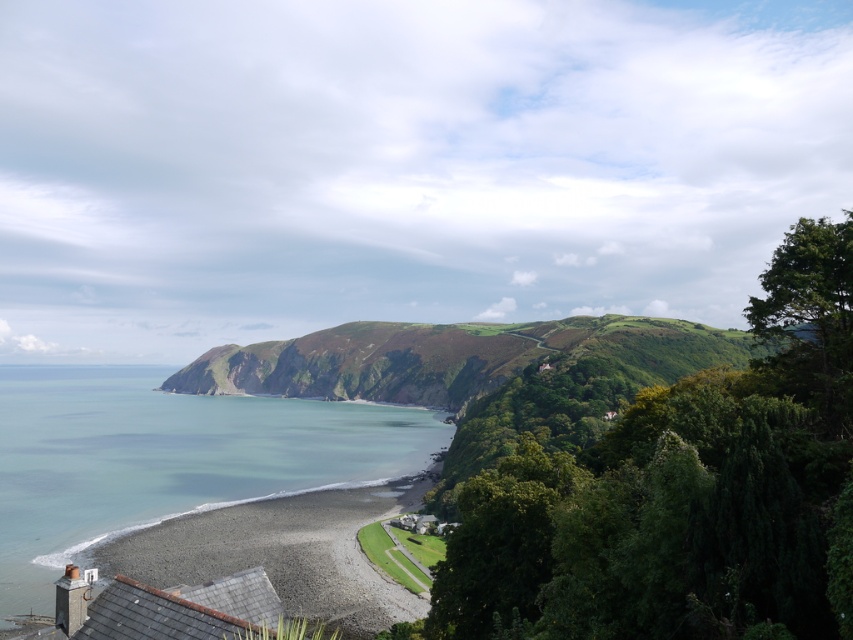
Is point (106, 381) behind point (125, 544)?

Yes, it is behind point (125, 544).

Does blue water at lower left have a greater height compared to gray gravel beach at lower left?

No, blue water at lower left is not taller than gray gravel beach at lower left.

Who is more distant from viewer, (x=396, y=467) or (x=184, y=532)?

Point (x=396, y=467)

You are a GUI agent. You are given a task and a screenshot of the screen. Output one action in this format:
    pyautogui.click(x=<x>, y=<y>)
    Task: Click on the blue water at lower left
    This screenshot has height=640, width=853.
    Given the screenshot: What is the action you would take?
    pyautogui.click(x=164, y=458)